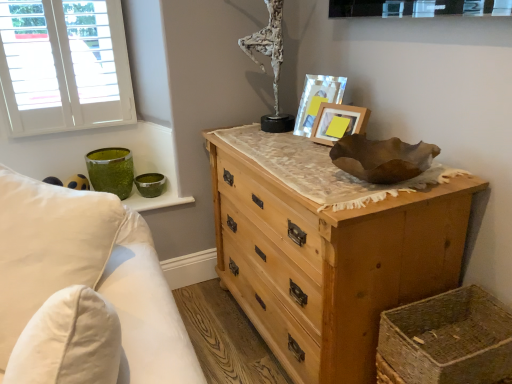
What do you see at coordinates (271, 63) in the screenshot? I see `white textured sculpture at upper center` at bounding box center [271, 63].

Measure the distance between white soft pillow at left and camera.

They are 36.18 inches apart.

Identify the location of white painted wood window at upper left. The width and height of the screenshot is (512, 384). (65, 68).

Could you tell me if white textured sculpture at upper center is turned towards white painted wood window at upper left?

No, white textured sculpture at upper center is not oriented towards white painted wood window at upper left.

Considering the sizes of objects white textured sculpture at upper center and white painted wood window at upper left in the image provided, who is taller, white textured sculpture at upper center or white painted wood window at upper left?

white painted wood window at upper left.

Consider the image. From the image's perspective, is white textured sculpture at upper center on top of white painted wood window at upper left?

Yes.

In the scene shown: From the image's perspective, is white soft pillow at left above or below woven straw basket at lower right?

Clearly, from the image's perspective, white soft pillow at left is above woven straw basket at lower right.

Is white soft pillow at left far from woven straw basket at lower right?

No, white soft pillow at left is not far away from woven straw basket at lower right.

Which of these two, white soft pillow at left or woven straw basket at lower right, stands taller?

With more height is white soft pillow at left.

From a real-world perspective, is white soft pillow at left over woven straw basket at lower right?

Yes, from a real-world perspective, white soft pillow at left is on top of woven straw basket at lower right.

Which of these two, natural wood chest of drawers at center or wooden picture frame at upper center, the second picture frame when ordered from back to front, stands taller?

natural wood chest of drawers at center.

Which is more to the right, natural wood chest of drawers at center or wooden picture frame at upper center, the second picture frame when ordered from back to front?

Positioned to the right is wooden picture frame at upper center, the second picture frame when ordered from back to front.

Is natural wood chest of drawers at center turned away from wooden picture frame at upper center, the second picture frame when ordered from back to front?

natural wood chest of drawers at center does not have its back to wooden picture frame at upper center, the second picture frame when ordered from back to front.

Considering the positions of points (345, 304) and (364, 115), is point (345, 304) farther from camera compared to point (364, 115)?

No, (345, 304) is closer to viewer.

How many degrees apart are the facing directions of natural wood chest of drawers at center and white textured sculpture at upper center?

natural wood chest of drawers at center and white textured sculpture at upper center are facing 0.408 degrees away from each other.

Between natural wood chest of drawers at center and white textured sculpture at upper center, which one has smaller size?

white textured sculpture at upper center.

Does point (215, 139) appear closer or farther from the camera than point (270, 2)?

Point (215, 139) is positioned farther from the camera compared to point (270, 2).

Which is correct: natural wood chest of drawers at center is inside white textured sculpture at upper center, or outside of it?

natural wood chest of drawers at center cannot be found inside white textured sculpture at upper center.

From the image's perspective, is wooden picture frame at upper center, arranged as the 1th picture frame when viewed from the front, above white painted wood window at upper left?

Actually, wooden picture frame at upper center, arranged as the 1th picture frame when viewed from the front, appears below white painted wood window at upper left in the image.

Image resolution: width=512 pixels, height=384 pixels. I want to click on window above the wooden picture frame at upper center, the second picture frame when ordered from back to front (from a real-world perspective), so click(65, 68).

Is wooden picture frame at upper center, the second picture frame when ordered from back to front, turned away from white painted wood window at upper left?

No, white painted wood window at upper left is not at the back of wooden picture frame at upper center, the second picture frame when ordered from back to front.

Is natural wood chest of drawers at center oriented away from white soft pillow at left?

No, natural wood chest of drawers at center is not facing the opposite direction of white soft pillow at left.

Considering the relative positions of natural wood chest of drawers at center and white soft pillow at left in the image provided, is natural wood chest of drawers at center to the left of white soft pillow at left from the viewer's perspective?

No.

Which of these two, natural wood chest of drawers at center or white soft pillow at left, is wider?

natural wood chest of drawers at center is wider.

From a real-world perspective, which object rests below the other?

wooden picture frame at upper center, arranged as the 1th picture frame when viewed from the front, is physically lower.

In the scene shown: In the image, is matte wooden picture frame at upper right, the 1th picture frame when ordered from back to front, positioned in front of or behind wooden picture frame at upper center, arranged as the 1th picture frame when viewed from the front?

matte wooden picture frame at upper right, the 1th picture frame when ordered from back to front, is positioned farther from the viewer than wooden picture frame at upper center, arranged as the 1th picture frame when viewed from the front.

At what (x,y) coordinates should I click in order to perform the action: click on window that appears below the white textured sculpture at upper center (from a real-world perspective). Please return your answer as a coordinate pair (x, y). This screenshot has width=512, height=384. Looking at the image, I should click on (65, 68).

Locate an element on the screen. This screenshot has width=512, height=384. basket below the white soft pillow at left (from the image's perspective) is located at coordinates (446, 340).

Estimate the real-world distances between objects in this image. Which object is closer to white soft pillow at left, woven straw basket at lower right or natural wood chest of drawers at center?

The object closer to white soft pillow at left is natural wood chest of drawers at center.

Looking at the image, which one is located closer to natural wood chest of drawers at center, white textured sculpture at upper center or woven straw basket at lower right?

woven straw basket at lower right is closer to natural wood chest of drawers at center.

Based on their spatial positions, is white soft pillow at left or white painted wood window at upper left further from white textured sculpture at upper center?

white soft pillow at left.

When comparing their distances from natural wood chest of drawers at center, does white textured sculpture at upper center or white soft pillow at left seem further?

white soft pillow at left is further to natural wood chest of drawers at center.

When comparing their distances from matte wooden picture frame at upper right, which is the second picture frame in front-to-back order, does wooden picture frame at upper center, the second picture frame when ordered from back to front, or white textured sculpture at upper center seem closer?

Among the two, wooden picture frame at upper center, the second picture frame when ordered from back to front, is located nearer to matte wooden picture frame at upper right, which is the second picture frame in front-to-back order.

Which object lies further to the anchor point woven straw basket at lower right, white soft pillow at left or natural wood chest of drawers at center?

white soft pillow at left is further to woven straw basket at lower right.

Based on their spatial positions, is woven straw basket at lower right or white soft pillow at left further from matte wooden picture frame at upper right, which is the second picture frame in front-to-back order?

white soft pillow at left.

Considering their positions, is white painted wood window at upper left positioned further to matte wooden picture frame at upper right, which is the second picture frame in front-to-back order, than white textured sculpture at upper center?

white painted wood window at upper left.

Where is `antique between white soft pillow at left and matte wooden picture frame at upper right, which is the second picture frame in front-to-back order, from front to back`? Image resolution: width=512 pixels, height=384 pixels. antique between white soft pillow at left and matte wooden picture frame at upper right, which is the second picture frame in front-to-back order, from front to back is located at coordinates (271, 63).

This screenshot has height=384, width=512. I want to click on basket located between white soft pillow at left and white textured sculpture at upper center in the depth direction, so click(x=446, y=340).

This screenshot has width=512, height=384. I want to click on picture frame between matte wooden picture frame at upper right, which is the second picture frame in front-to-back order, and woven straw basket at lower right vertically, so click(x=338, y=122).

Identify the location of chest of drawers between white painted wood window at upper left and matte wooden picture frame at upper right, the 1th picture frame when ordered from back to front, in the horizontal direction. (330, 262).